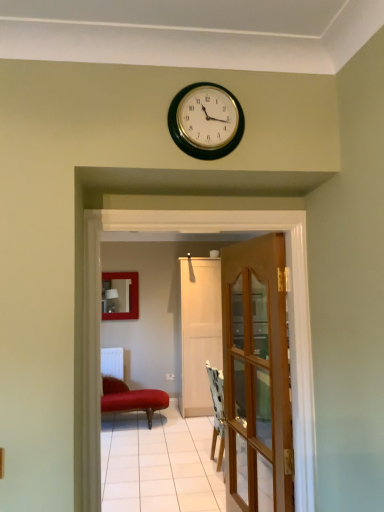
Question: Is wooden glass door at center, acting as the 1th door starting from the front, touching white glossy door at center?

Choices:
 (A) no
 (B) yes

Answer: (A)

Question: Can white glossy door at center be found inside wooden glass door at center, the 2th door in the back-to-front sequence?

Choices:
 (A) no
 (B) yes

Answer: (A)

Question: Is wooden glass door at center, the 2th door in the back-to-front sequence, wider than white glossy door at center?

Choices:
 (A) yes
 (B) no

Answer: (B)

Question: From a real-world perspective, is wooden glass door at center, the 2th door in the back-to-front sequence, on top of white glossy door at center?

Choices:
 (A) yes
 (B) no

Answer: (B)

Question: From the image's perspective, is wooden glass door at center, acting as the 1th door starting from the front, on top of white glossy door at center?

Choices:
 (A) yes
 (B) no

Answer: (B)

Question: From the image's perspective, is wooden glass door at center, acting as the 1th door starting from the front, positioned above or below velvet red studio couch at center?

Choices:
 (A) above
 (B) below

Answer: (A)

Question: From a real-world perspective, is wooden glass door at center, acting as the 1th door starting from the front, above or below velvet red studio couch at center?

Choices:
 (A) above
 (B) below

Answer: (A)

Question: Is wooden glass door at center, acting as the 1th door starting from the front, to the left or to the right of velvet red studio couch at center in the image?

Choices:
 (A) left
 (B) right

Answer: (B)

Question: Is point (254, 472) closer or farther from the camera than point (139, 394)?

Choices:
 (A) closer
 (B) farther

Answer: (A)

Question: From the image's perspective, is metallic gold clock at upper center located above or below velvet red studio couch at center?

Choices:
 (A) above
 (B) below

Answer: (A)

Question: In terms of size, does metallic gold clock at upper center appear bigger or smaller than velvet red studio couch at center?

Choices:
 (A) small
 (B) big

Answer: (A)

Question: Considering the relative positions of metallic gold clock at upper center and velvet red studio couch at center in the image provided, is metallic gold clock at upper center to the left or to the right of velvet red studio couch at center?

Choices:
 (A) left
 (B) right

Answer: (B)

Question: Is metallic gold clock at upper center wider or thinner than velvet red studio couch at center?

Choices:
 (A) wide
 (B) thin

Answer: (B)

Question: Considering the positions of velvet red studio couch at center and metallic gold clock at upper center in the image, is velvet red studio couch at center taller or shorter than metallic gold clock at upper center?

Choices:
 (A) short
 (B) tall

Answer: (B)

Question: From the image's perspective, is velvet red studio couch at center positioned above or below metallic gold clock at upper center?

Choices:
 (A) below
 (B) above

Answer: (A)